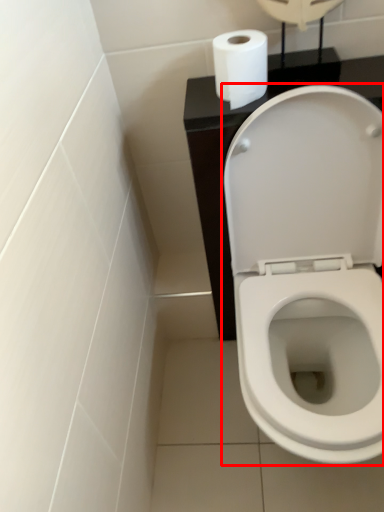
Question: From the image's perspective, where is toilet (annotated by the red box) located in relation to toilet paper in the image?

Choices:
 (A) above
 (B) below

Answer: (B)